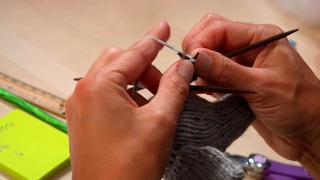
Find the location of `written notes`. written notes is located at coordinates (5, 126), (4, 147), (21, 155).